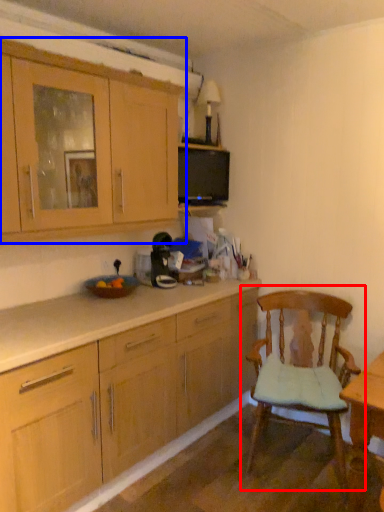
Question: Which object is further to the camera taking this photo, chair (highlighted by a red box) or cabinetry (highlighted by a blue box)?

Choices:
 (A) chair
 (B) cabinetry

Answer: (A)